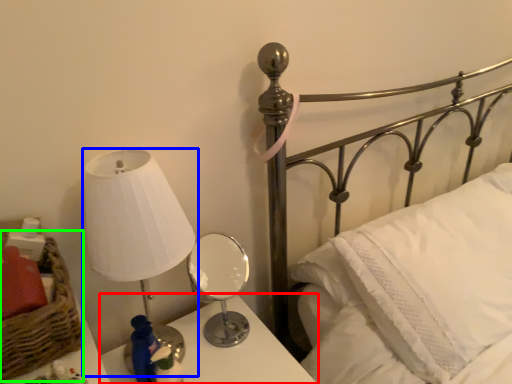
Question: Based on their relative distances, which object is nearer to nightstand (highlighted by a red box)? Choose from lamp (highlighted by a blue box) and basket (highlighted by a green box).

Choices:
 (A) lamp
 (B) basket

Answer: (A)